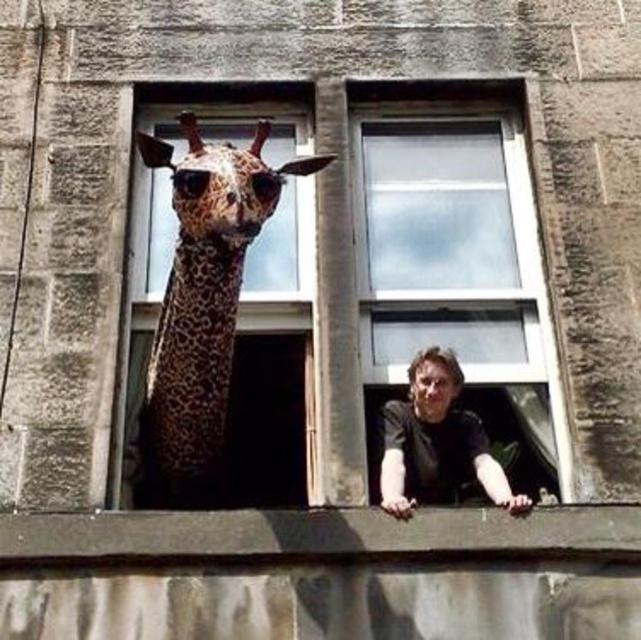
You are a delivery person with a box that is 3 meters long. You need to place the box between the spotted brown spotted giraffe at left and the dark brown leather jacket at center. Is there enough space to fit the box between them?

The distance between the spotted brown spotted giraffe at left and the dark brown leather jacket at center is 3.12 meters. Since the box is 3 meters long, there is enough space to fit the box between them.

You are a delivery person holding a package that is 1.6 meters long. You need to slide it through the gap between the clear glass window at center and the dark brown leather jacket at center. Can you fit the package through the gap?

The gap between the clear glass window at center and the dark brown leather jacket at center is 1.55 meters, which is shorter than the 1.6 meters package. Therefore, the package cannot fit through the gap.

You are standing in front of a building with two windows. You notice a clear glass window at center and a dark brown leather jacket at center. According to the scene, which object is positioned to the left?

The clear glass window at center is to the left of the dark brown leather jacket at center.